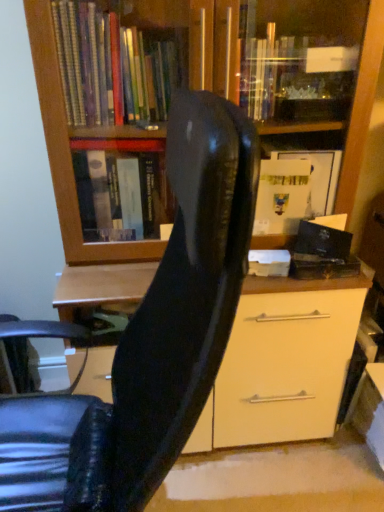
Question: Does matte wood bookcase at upper center turn towards black matte book at right?

Choices:
 (A) no
 (B) yes

Answer: (B)

Question: Can you confirm if matte wood bookcase at upper center is taller than black matte book at right?

Choices:
 (A) no
 (B) yes

Answer: (B)

Question: Is matte wood bookcase at upper center smaller than black matte book at right?

Choices:
 (A) yes
 (B) no

Answer: (B)

Question: From a real-world perspective, is matte wood bookcase at upper center under black matte book at right?

Choices:
 (A) no
 (B) yes

Answer: (B)

Question: Is matte wood bookcase at upper center not within black matte book at right?

Choices:
 (A) yes
 (B) no

Answer: (A)

Question: Is matte wood bookcase at upper center turned away from black matte book at right?

Choices:
 (A) no
 (B) yes

Answer: (B)

Question: Is matte wood bookcase at upper center positioned beyond the bounds of glossy black chair at center?

Choices:
 (A) yes
 (B) no

Answer: (A)

Question: Can you confirm if matte wood bookcase at upper center is bigger than glossy black chair at center?

Choices:
 (A) no
 (B) yes

Answer: (B)

Question: Is matte wood bookcase at upper center positioned before glossy black chair at center?

Choices:
 (A) no
 (B) yes

Answer: (A)

Question: Is matte wood bookcase at upper center thinner than glossy black chair at center?

Choices:
 (A) yes
 (B) no

Answer: (A)

Question: From the image's perspective, would you say matte wood bookcase at upper center is shown under glossy black chair at center?

Choices:
 (A) no
 (B) yes

Answer: (A)

Question: From a real-world perspective, is matte wood bookcase at upper center under glossy black chair at center?

Choices:
 (A) yes
 (B) no

Answer: (B)

Question: Is black matte book at right at the right side of matte wood bookcase at upper center?

Choices:
 (A) yes
 (B) no

Answer: (A)